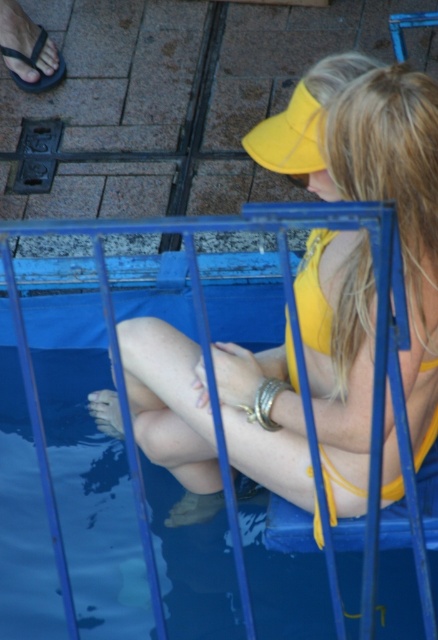
You are a lifeguard on duty at the pool. You notice a swimmer struggling near the blue plastic pool at center. Can you see their yellow matte bikini top at center from your current position?

The yellow matte bikini top at center is positioned over blue plastic pool at center, so yes, the lifeguard can see the swimmer wearing the yellow matte bikini top at center because it is visible above the blue plastic pool at center.